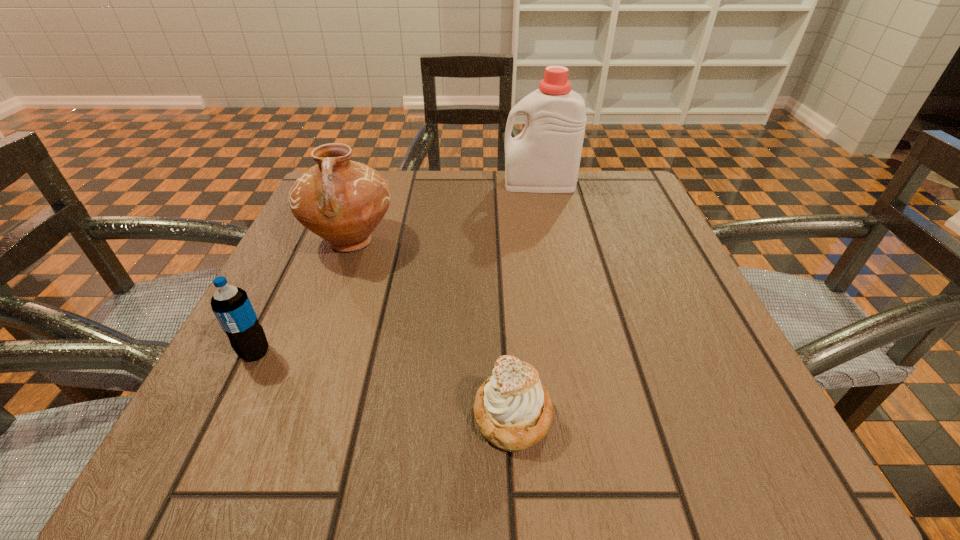
Where is `vacant space in between the tallest object and the shortest object`? This screenshot has height=540, width=960. vacant space in between the tallest object and the shortest object is located at coordinates (526, 300).

At what (x,y) coordinates should I click in order to perform the action: click on vacant area that lies between the second nearest object and the pastry. Please return your answer as a coordinate pair (x, y). The image size is (960, 540). Looking at the image, I should click on (384, 384).

The width and height of the screenshot is (960, 540). I want to click on free point between the soda bottle and the second farthest object, so click(303, 296).

The image size is (960, 540). I want to click on empty space between the detergent and the pastry, so click(x=526, y=300).

In order to click on vacant area between the second shortest object and the detergent in this screenshot , I will do `click(397, 268)`.

Identify the location of empty space between the shortest object and the second shortest object. The height and width of the screenshot is (540, 960). (384, 384).

What are the coordinates of `vacant space that is in between the detergent and the shortest object` in the screenshot? It's located at (526, 300).

Identify the location of empty space that is in between the second tallest object and the nearest object. The height and width of the screenshot is (540, 960). (432, 328).

The height and width of the screenshot is (540, 960). I want to click on the second closest object to the tallest object, so click(513, 410).

Locate an element on the screen. Image resolution: width=960 pixels, height=540 pixels. object that is the second closest one to the pastry is located at coordinates (231, 305).